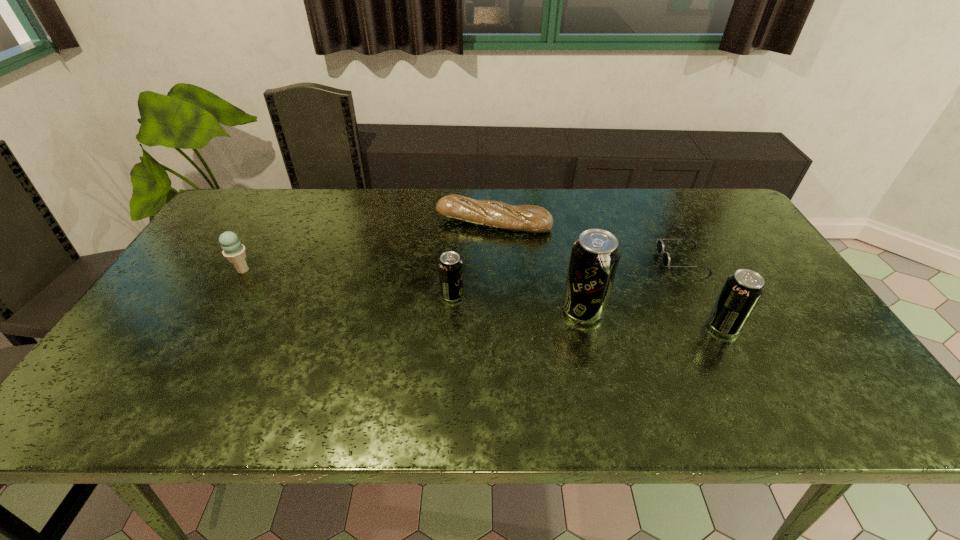
Find the location of `vacant space at the near edge of the desktop`. vacant space at the near edge of the desktop is located at coordinates (567, 380).

In order to click on vacant space at the right edge in this screenshot , I will do `click(775, 262)`.

Where is `free space at the far left corner of the desktop`? Image resolution: width=960 pixels, height=540 pixels. free space at the far left corner of the desktop is located at coordinates (275, 204).

At what (x,y) coordinates should I click in order to perform the action: click on vacant space at the far right corner. Please return your answer as a coordinate pair (x, y). This screenshot has width=960, height=540. Looking at the image, I should click on (733, 228).

At what (x,y) coordinates should I click in order to perform the action: click on free space at the near right corner. Please return your answer as a coordinate pair (x, y). Looking at the image, I should click on (836, 359).

This screenshot has width=960, height=540. Find the location of `free space that is in between the fifth shortest object and the ice cream`. free space that is in between the fifth shortest object and the ice cream is located at coordinates (483, 298).

Locate an element on the screen. This screenshot has width=960, height=540. vacant region between the tallest soda can and the leftmost soda can is located at coordinates (517, 302).

Where is `vacant space in between the rightmost soda can and the leftmost object`? Image resolution: width=960 pixels, height=540 pixels. vacant space in between the rightmost soda can and the leftmost object is located at coordinates (483, 298).

What are the coordinates of `vacant area that lies between the leftmost object and the tallest object` in the screenshot? It's located at pyautogui.click(x=413, y=290).

Where is `free space between the fifth tallest object and the second soda can from right to left`? free space between the fifth tallest object and the second soda can from right to left is located at coordinates (539, 266).